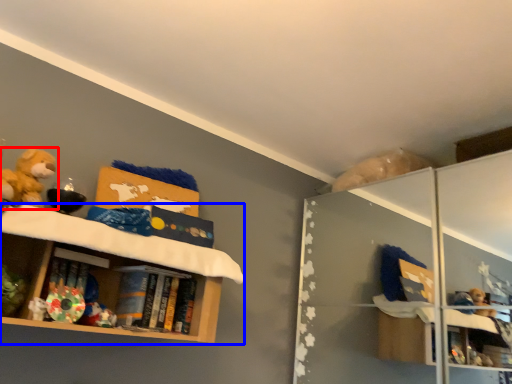
Question: Which of the following is the farthest to the observer, toy (highlighted by a red box) or shelf (highlighted by a blue box)?

Choices:
 (A) toy
 (B) shelf

Answer: (A)